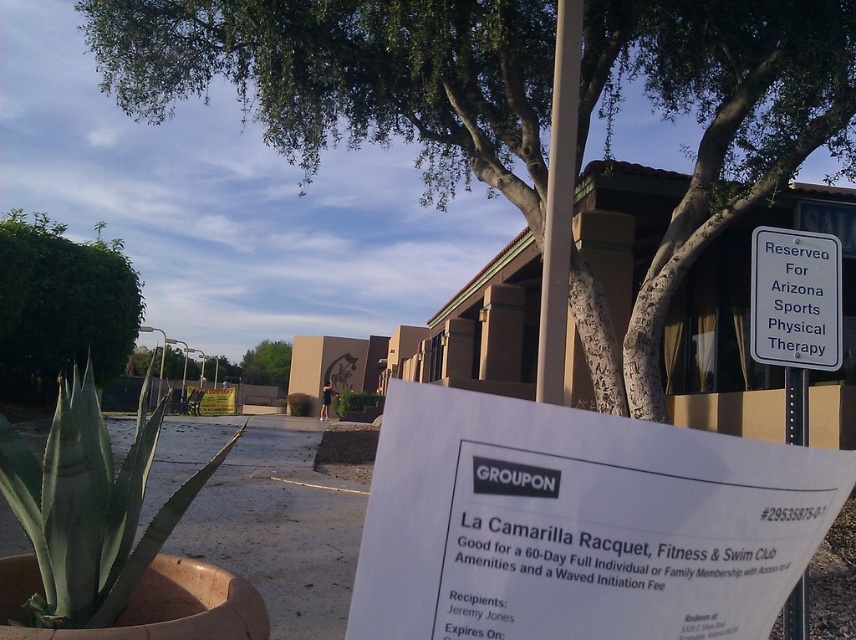
Question: Does white plastic sign at upper right have a greater width compared to green leafy tree at center?

Choices:
 (A) no
 (B) yes

Answer: (A)

Question: Which point appears closest to the camera in this image?

Choices:
 (A) (723, 109)
 (B) (284, 385)

Answer: (A)

Question: Can you confirm if green succulent at lower left is bigger than green leafy tree at upper left?

Choices:
 (A) no
 (B) yes

Answer: (A)

Question: Considering the real-world distances, which object is farthest from the green leafy tree at upper center?

Choices:
 (A) green leafy tree at center
 (B) green succulent at lower left
 (C) green leafy plant at center

Answer: (A)

Question: Which object appears closest to the camera in this image?

Choices:
 (A) white plastic sign at upper right
 (B) metallic pole at center
 (C) green leafy tree at center
 (D) green succulent at lower left

Answer: (D)

Question: Can you confirm if green leafy tree at upper center is positioned to the left of green leafy tree at upper left?

Choices:
 (A) yes
 (B) no

Answer: (B)